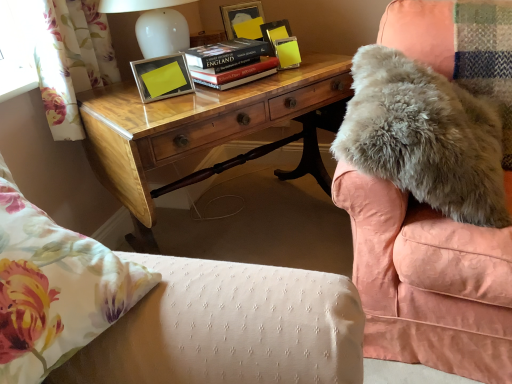
Where is `vacant region in front of metallic yellow picture frame at upper center`? The height and width of the screenshot is (384, 512). vacant region in front of metallic yellow picture frame at upper center is located at coordinates (170, 110).